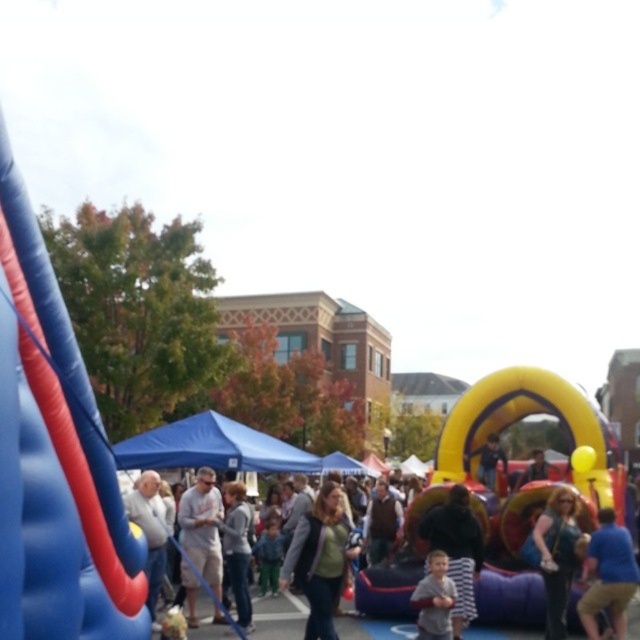
Question: Which point appears closest to the camera in this image?

Choices:
 (A) pos(568,538)
 (B) pos(340,632)
 (C) pos(316,582)
 (D) pos(209,477)

Answer: (C)

Question: Can you confirm if blue rubber slide at left is thinner than green sweater at center?

Choices:
 (A) no
 (B) yes

Answer: (B)

Question: Which object is closer to the camera taking this photo?

Choices:
 (A) gray cotton shirt at center
 (B) green fabric jacket at center
 (C) blue rubber slide at left
 (D) light gray sweater at center

Answer: (C)

Question: Observing the image, what is the correct spatial positioning of green fabric jacket at center in reference to shiny blue purse at center?

Choices:
 (A) above
 (B) below

Answer: (B)

Question: Which object appears farthest from the camera in this image?

Choices:
 (A) green fabric jacket at center
 (B) light gray sweater at center

Answer: (B)

Question: Can you confirm if striped fabric shirt at center is positioned below light gray sweater at center?

Choices:
 (A) yes
 (B) no

Answer: (A)